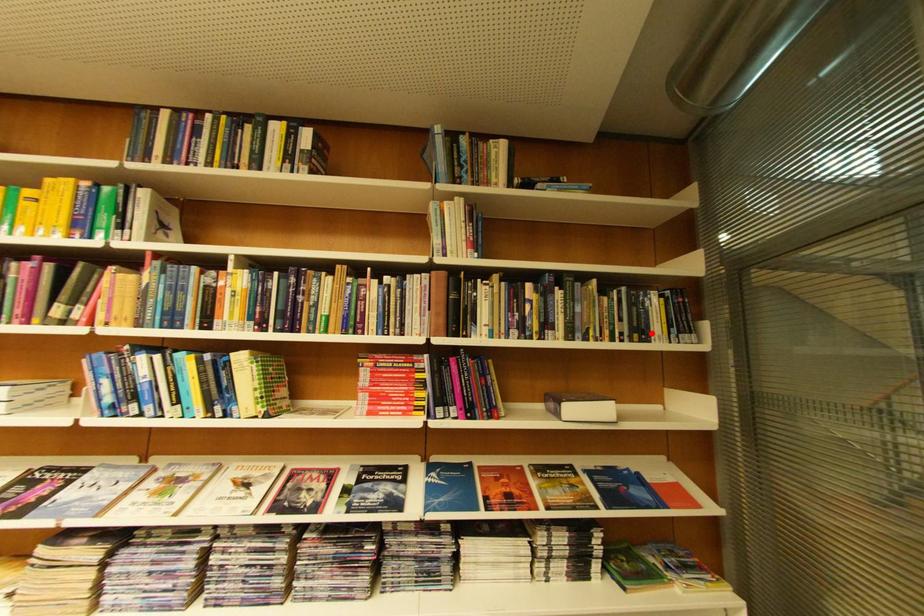
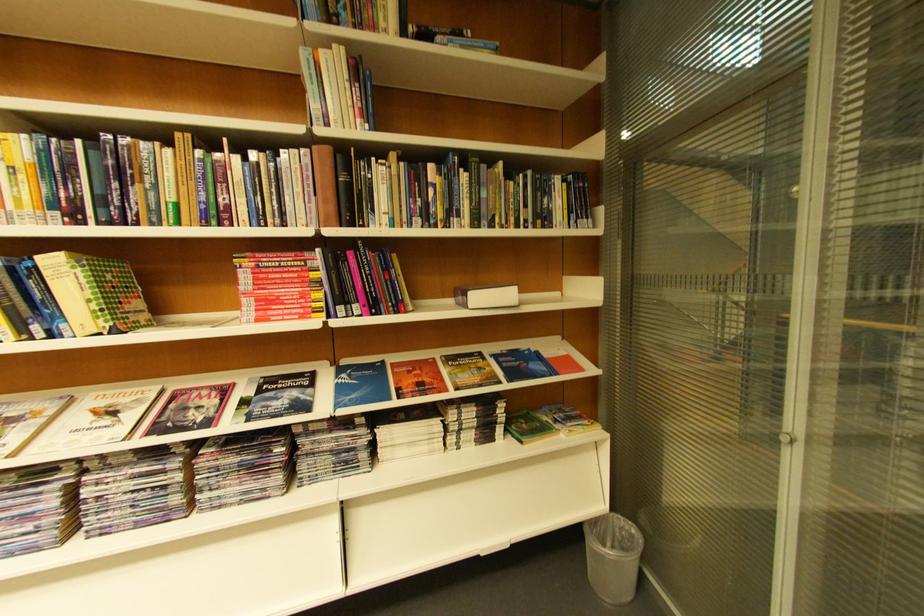
The point at the highlighted location is marked in the first image. Where is the corresponding point in the second image?

(554, 221)